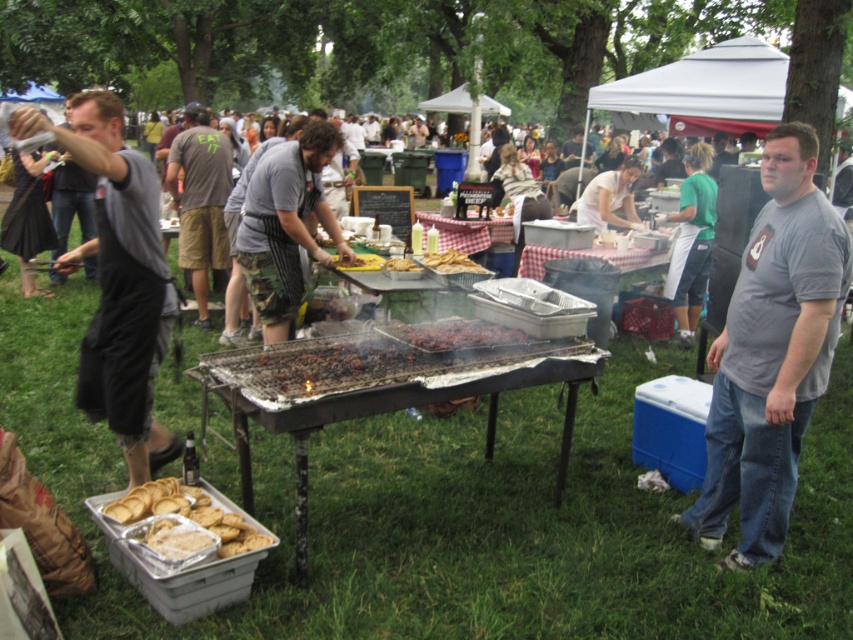
You are a photographer at this outdoor gathering. You want to take a photo that includes both the gray fabric shirt at left and the golden crispy fries at center. Which object should you focus on first to ensure both are in frame?

Since the gray fabric shirt at left is much taller than the golden crispy fries at center, you should focus on the gray fabric shirt at left first to ensure both are in frame.

You are standing at point [515,340] and want to walk to the large grill in the foreground. Is the point [183,224] located between you and the grill?

Yes, point [183,224] is located between you and the grill because it is behind point [515,340], which is your current position.